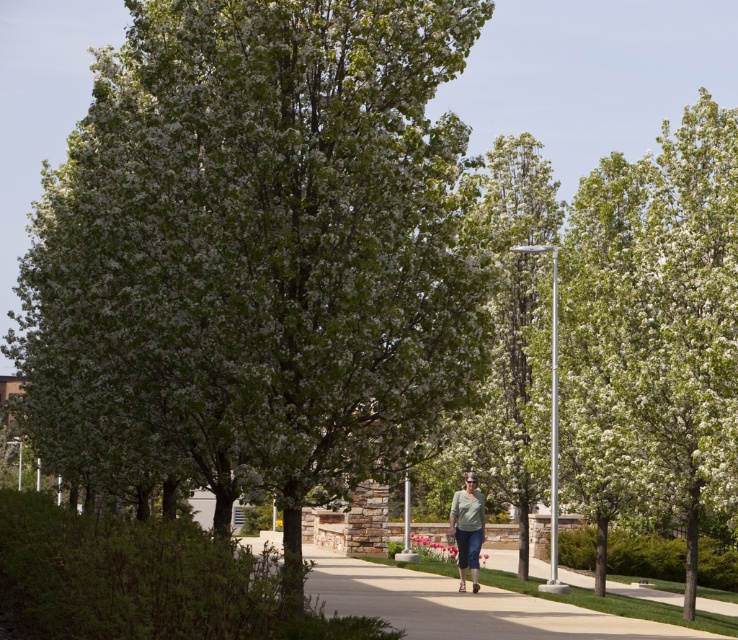
The width and height of the screenshot is (738, 640). What do you see at coordinates (255, 253) in the screenshot?
I see `green leafy tree at center` at bounding box center [255, 253].

Which is in front, point (221, 308) or point (455, 586)?

Point (221, 308)

Locate an element on the screen. The width and height of the screenshot is (738, 640). green leafy tree at center is located at coordinates (255, 253).

Is smooth concrete sidewalk at center bigger than light green fabric shirt at center?

Indeed, smooth concrete sidewalk at center has a larger size compared to light green fabric shirt at center.

This screenshot has width=738, height=640. In order to click on smooth concrete sidewalk at center in this screenshot , I will do `click(461, 604)`.

Measure the distance between point (463, 397) and camera.

The distance of point (463, 397) from camera is 38.48 feet.

Is point (292, 76) more distant than point (472, 534)?

No, (292, 76) is closer to viewer.

The image size is (738, 640). Find the location of `green leafy tree at center`. green leafy tree at center is located at coordinates (255, 253).